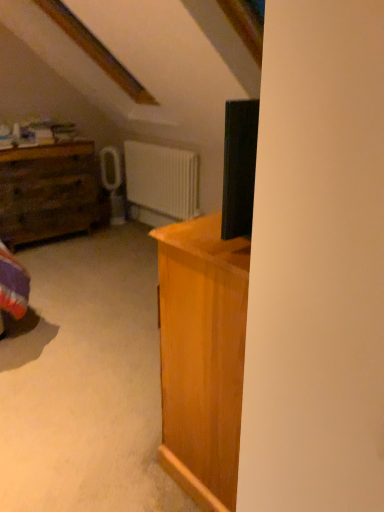
Question: From a real-world perspective, is white matte radiator at center positioned above or below rustic wood chest of drawers at left?

Choices:
 (A) below
 (B) above

Answer: (B)

Question: From the image's perspective, is white matte radiator at center positioned above or below rustic wood chest of drawers at left?

Choices:
 (A) above
 (B) below

Answer: (A)

Question: Looking at their shapes, would you say white matte radiator at center is wider or thinner than rustic wood chest of drawers at left?

Choices:
 (A) thin
 (B) wide

Answer: (A)

Question: Is point (33, 203) closer or farther from the camera than point (175, 184)?

Choices:
 (A) closer
 (B) farther

Answer: (A)

Question: From their relative heights in the image, would you say rustic wood chest of drawers at left is taller or shorter than white matte radiator at center?

Choices:
 (A) short
 (B) tall

Answer: (B)

Question: From a real-world perspective, is rustic wood chest of drawers at left physically located above or below white matte radiator at center?

Choices:
 (A) above
 (B) below

Answer: (B)

Question: Looking at the image, does rustic wood chest of drawers at left seem bigger or smaller compared to white matte radiator at center?

Choices:
 (A) big
 (B) small

Answer: (A)